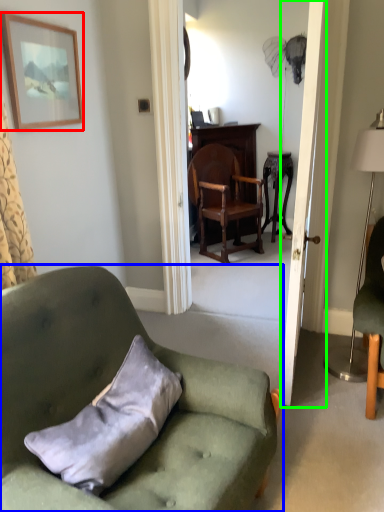
Question: Estimate the real-world distances between objects in this image. Which object is farther from picture frame (highlighted by a red box), chair (highlighted by a blue box) or door (highlighted by a green box)?

Choices:
 (A) chair
 (B) door

Answer: (B)